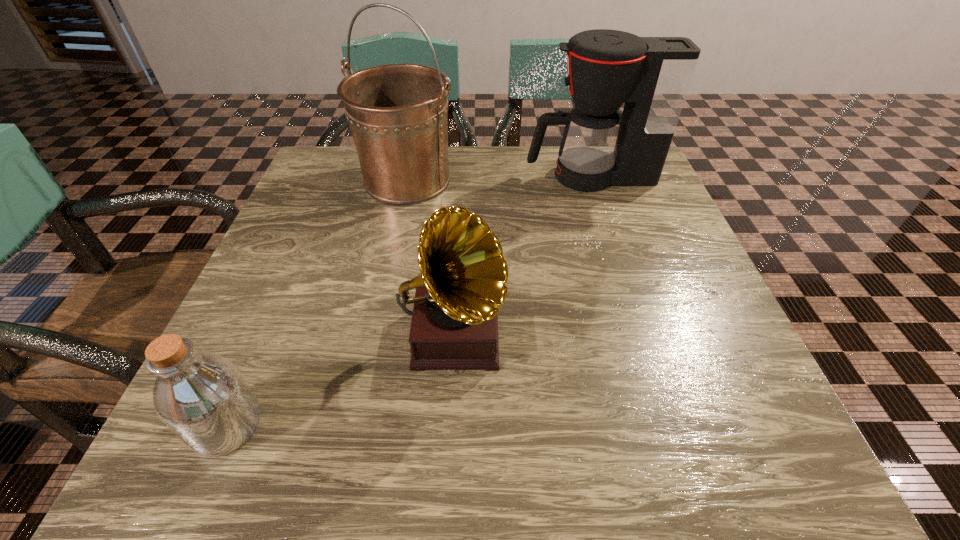
Find the location of `free point located from the horn of the phonograph record`. free point located from the horn of the phonograph record is located at coordinates (447, 448).

Image resolution: width=960 pixels, height=540 pixels. I want to click on free space located 0.320m on the back of the shortest object, so click(303, 249).

The height and width of the screenshot is (540, 960). What are the coordinates of `bucket present at the far edge` in the screenshot? It's located at (397, 113).

I want to click on coffee maker present at the far edge, so click(x=652, y=75).

This screenshot has width=960, height=540. I want to click on object that is at the near edge, so click(x=202, y=397).

Where is `bucket situated at the left edge`? The image size is (960, 540). bucket situated at the left edge is located at coordinates (397, 113).

Find the location of `bottle present at the left edge`. bottle present at the left edge is located at coordinates (202, 397).

This screenshot has width=960, height=540. I want to click on object positioned at the right edge, so click(652, 75).

You are a GUI agent. You are given a task and a screenshot of the screen. Output one action in this format:
    pyautogui.click(x=<x>, y=<y>)
    Task: Click on the object that is at the far left corner
    This screenshot has height=540, width=960.
    Given the screenshot: What is the action you would take?
    pyautogui.click(x=397, y=113)

At what (x,y) coordinates should I click in order to perform the action: click on object that is at the near left corner. Please return your answer as a coordinate pair (x, y). This screenshot has height=540, width=960. Looking at the image, I should click on pos(202,397).